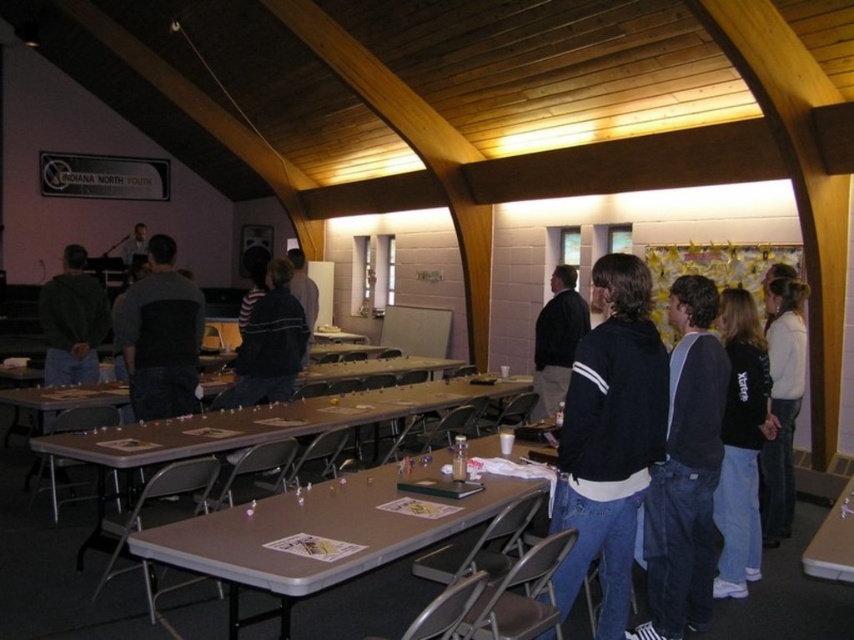
Question: Which of the following is the closest to the observer?

Choices:
 (A) black jacket at center
 (B) dark blue sweater at center
 (C) white sweater at right
 (D) dark blue jeans at center

Answer: (D)

Question: Which of the following is the closest to the observer?

Choices:
 (A) dark gray hoodie at left
 (B) black sweater at center
 (C) black jacket at center
 (D) black fleece jacket at lower right

Answer: (D)

Question: Can you confirm if black fleece jacket at center is positioned below black sweater at center?

Choices:
 (A) yes
 (B) no

Answer: (A)

Question: Which object is the closest to the white sweater at right?

Choices:
 (A) smooth white table at lower right
 (B) metallic gray table at center
 (C) black sweater at center

Answer: (A)

Question: In this image, where is black fleece jacket at lower right located relative to dark gray sweater at center?

Choices:
 (A) left
 (B) right

Answer: (B)

Question: Does dark blue jeans at center have a smaller size compared to dark gray hoodie at left?

Choices:
 (A) yes
 (B) no

Answer: (A)